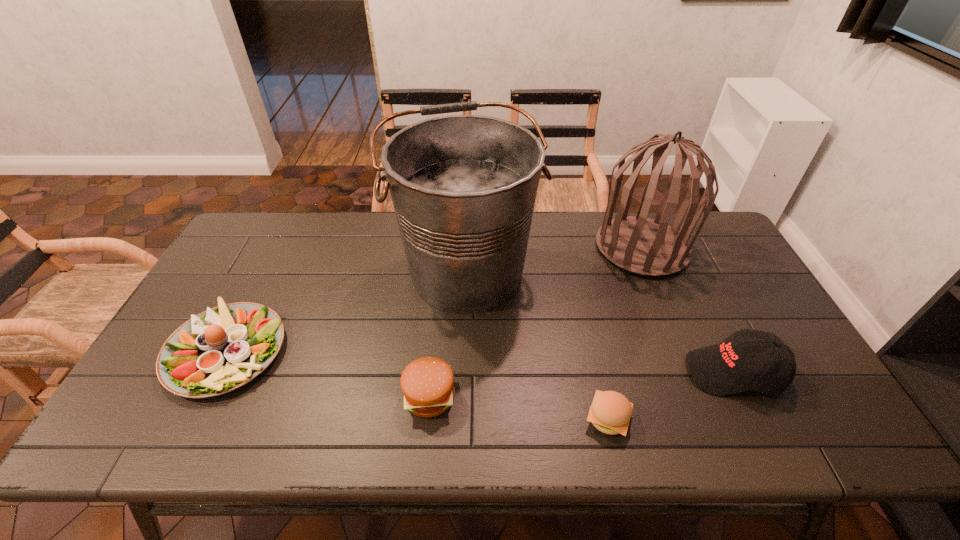
Image resolution: width=960 pixels, height=540 pixels. Find the location of `bucket`. bucket is located at coordinates (463, 187).

At what (x,y) coordinates should I click in order to perform the action: click on birdcage. Please return your answer as a coordinate pair (x, y). This screenshot has width=960, height=540. Looking at the image, I should click on (638, 244).

The image size is (960, 540). What are the coordinates of `baseball cap` in the screenshot? It's located at (726, 368).

At what (x,y) coordinates should I click in order to perform the action: click on salad plate. Please return your answer as a coordinate pair (x, y). This screenshot has width=960, height=540. Looking at the image, I should click on (223, 348).

Locate an element on the screen. the left hamburger is located at coordinates (427, 383).

The height and width of the screenshot is (540, 960). In order to click on the right hamburger in this screenshot , I will do `click(610, 412)`.

The image size is (960, 540). I want to click on the shortest object, so click(610, 412).

I want to click on vacant space located 0.250m on the right of the bucket, so click(621, 272).

I want to click on vacant area located 0.360m on the front of the birdcage, so click(696, 381).

Locate an element on the screen. The height and width of the screenshot is (540, 960). vacant space located on the front-facing side of the baseball cap is located at coordinates (650, 372).